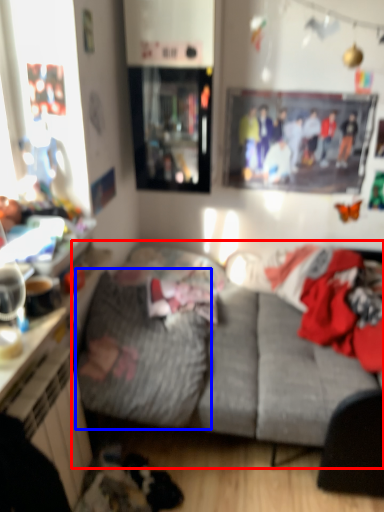
Question: Which object appears closest to the camera in this image, studio couch (highlighted by a red box) or blanket (highlighted by a blue box)?

Choices:
 (A) studio couch
 (B) blanket

Answer: (A)